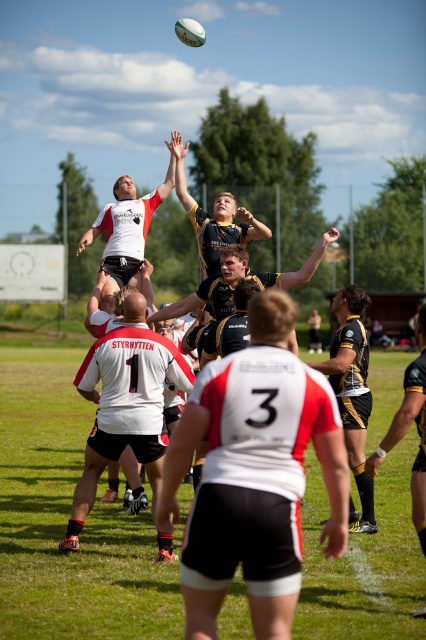
Can you confirm if white matte jersey at center is positioned below gold textured jersey at center?

Indeed, white matte jersey at center is positioned under gold textured jersey at center.

Between white matte jersey at center and gold textured jersey at center, which one appears on the right side from the viewer's perspective?

gold textured jersey at center

Measure the distance between white matte jersey at center and camera.

white matte jersey at center is 8.34 meters from camera.

Locate an element on the screen. The height and width of the screenshot is (640, 426). white matte jersey at center is located at coordinates (124, 404).

Between point (172, 372) and point (121, 220), which one is positioned in front?

Point (172, 372) is in front.

Is white matte jersey at center to the left of white matte rugby ball at upper center from the viewer's perspective?

No, white matte jersey at center is not to the left of white matte rugby ball at upper center.

Describe the element at coordinates (124, 404) in the screenshot. This screenshot has width=426, height=640. I see `white matte jersey at center` at that location.

The height and width of the screenshot is (640, 426). In order to click on white matte jersey at center in this screenshot , I will do `click(124, 404)`.

Can you confirm if gold textured jersey at center is positioned to the left of white matte rugby ball at upper center?

In fact, gold textured jersey at center is to the right of white matte rugby ball at upper center.

Does gold textured jersey at center appear over white matte rugby ball at upper center?

Actually, gold textured jersey at center is below white matte rugby ball at upper center.

You are a GUI agent. You are given a task and a screenshot of the screen. Output one action in this format:
    pyautogui.click(x=<x>, y=<y>)
    Task: Click on the gold textured jersey at center
    
    Given the screenshot: What is the action you would take?
    pyautogui.click(x=351, y=394)